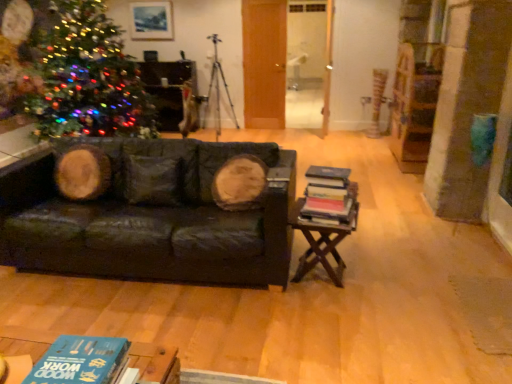
This screenshot has width=512, height=384. What are the coordinates of `empty space that is to the right of wooden at right` in the screenshot? It's located at (378, 277).